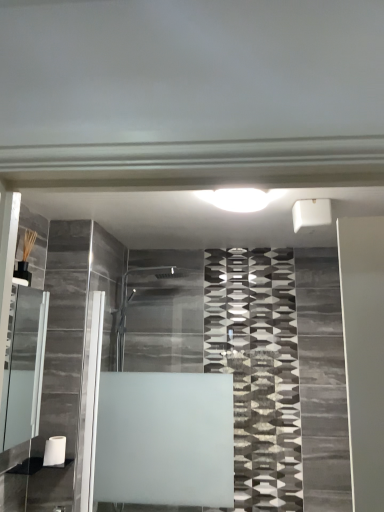
Question: Is matte glass cabinet at left wider than frosted glass shower door at center?

Choices:
 (A) no
 (B) yes

Answer: (B)

Question: Can you confirm if matte glass cabinet at left is bigger than frosted glass shower door at center?

Choices:
 (A) no
 (B) yes

Answer: (B)

Question: Does matte glass cabinet at left contain frosted glass shower door at center?

Choices:
 (A) no
 (B) yes

Answer: (A)

Question: Is matte glass cabinet at left facing away from frosted glass shower door at center?

Choices:
 (A) yes
 (B) no

Answer: (B)

Question: Considering the relative sizes of matte glass cabinet at left and frosted glass shower door at center in the image provided, is matte glass cabinet at left smaller than frosted glass shower door at center?

Choices:
 (A) yes
 (B) no

Answer: (B)

Question: Considering the relative sizes of matte glass cabinet at left and frosted glass shower door at center in the image provided, is matte glass cabinet at left taller than frosted glass shower door at center?

Choices:
 (A) no
 (B) yes

Answer: (A)

Question: Is white glossy light at center in contact with frosted glass shower door at center?

Choices:
 (A) yes
 (B) no

Answer: (B)

Question: From a real-world perspective, is white glossy light at center positioned under frosted glass shower door at center based on gravity?

Choices:
 (A) yes
 (B) no

Answer: (B)

Question: Does white glossy light at center appear on the right side of frosted glass shower door at center?

Choices:
 (A) yes
 (B) no

Answer: (A)

Question: Is white glossy light at center smaller than frosted glass shower door at center?

Choices:
 (A) yes
 (B) no

Answer: (A)

Question: Is white glossy light at center turned away from frosted glass shower door at center?

Choices:
 (A) no
 (B) yes

Answer: (A)

Question: Can you confirm if white glossy light at center is shorter than frosted glass shower door at center?

Choices:
 (A) yes
 (B) no

Answer: (A)

Question: Is the depth of matte glass cabinet at left greater than that of white matte toilet paper at lower left?

Choices:
 (A) yes
 (B) no

Answer: (B)